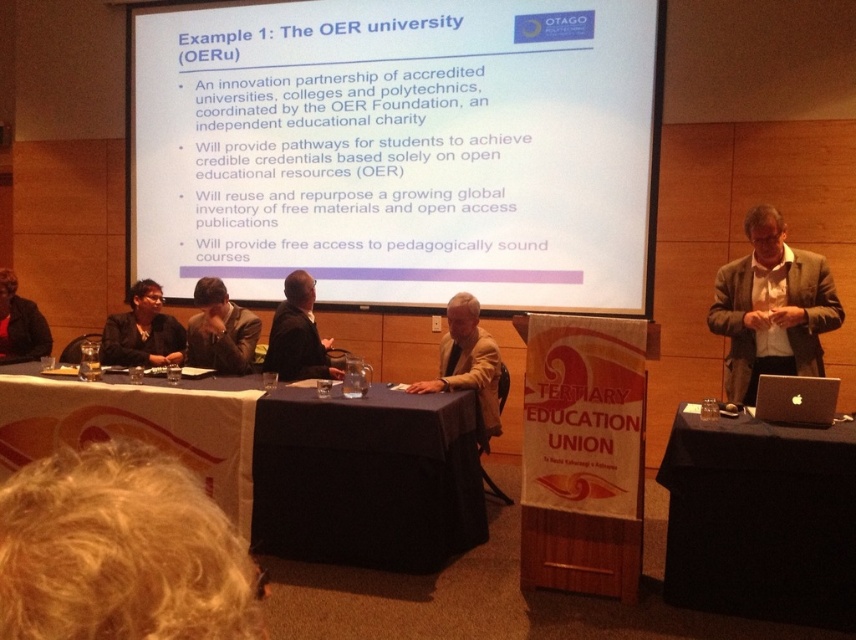
Consider the image. You are a guest speaker at the presentation and need to place your dark brown leather jacket at center on the blue fabric table at center. Can you do this without moving the table?

The blue fabric table at center is below dark brown leather jacket at center, so yes, you can place the dark brown leather jacket at center on the blue fabric table at center without moving the table.

Consider the image. You are organizing a conference and need to place a large banner on the table. The banner is 1.5 meters wide. Can the blue fabric table at center accommodate the banner without overlapping the dark brown leather jacket at center?

The blue fabric table at center has a larger size compared to the dark brown leather jacket at center. Since the table is bigger, it can accommodate the 1.5 meter wide banner without overlapping the jacket if positioned properly.